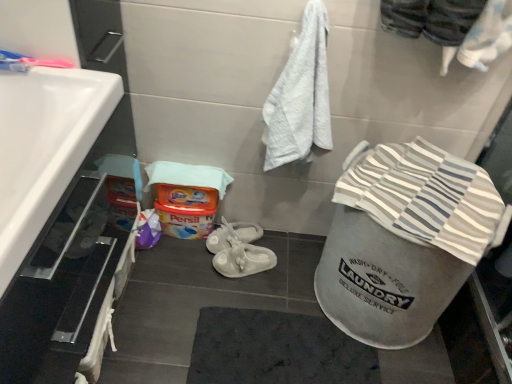
Question: From the image's perspective, is striped cotton beach towel at lower right beneath white glossy sink at left?

Choices:
 (A) yes
 (B) no

Answer: (A)

Question: From a real-world perspective, does striped cotton beach towel at lower right sit lower than white glossy sink at left?

Choices:
 (A) no
 (B) yes

Answer: (B)

Question: Is the position of striped cotton beach towel at lower right less distant than that of white glossy sink at left?

Choices:
 (A) no
 (B) yes

Answer: (A)

Question: Does striped cotton beach towel at lower right have a lesser width compared to white glossy sink at left?

Choices:
 (A) yes
 (B) no

Answer: (B)

Question: Considering the relative sizes of striped cotton beach towel at lower right and white glossy sink at left in the image provided, is striped cotton beach towel at lower right shorter than white glossy sink at left?

Choices:
 (A) yes
 (B) no

Answer: (A)

Question: From the image's perspective, would you say striped cotton beach towel at lower right is positioned over white glossy sink at left?

Choices:
 (A) yes
 (B) no

Answer: (B)

Question: Is white rubber sandals at center not within striped cotton beach towel at lower right?

Choices:
 (A) yes
 (B) no

Answer: (A)

Question: Can you confirm if white rubber sandals at center is shorter than striped cotton beach towel at lower right?

Choices:
 (A) yes
 (B) no

Answer: (B)

Question: From the image's perspective, is white rubber sandals at center on striped cotton beach towel at lower right?

Choices:
 (A) no
 (B) yes

Answer: (A)

Question: Is the position of white rubber sandals at center more distant than that of striped cotton beach towel at lower right?

Choices:
 (A) no
 (B) yes

Answer: (B)

Question: Is striped cotton beach towel at lower right a part of white rubber sandals at center?

Choices:
 (A) yes
 (B) no

Answer: (B)

Question: Is white rubber sandals at center at the right side of striped cotton beach towel at lower right?

Choices:
 (A) yes
 (B) no

Answer: (B)

Question: Is white rubber sandals at center surrounded by white glossy sink at left?

Choices:
 (A) yes
 (B) no

Answer: (B)